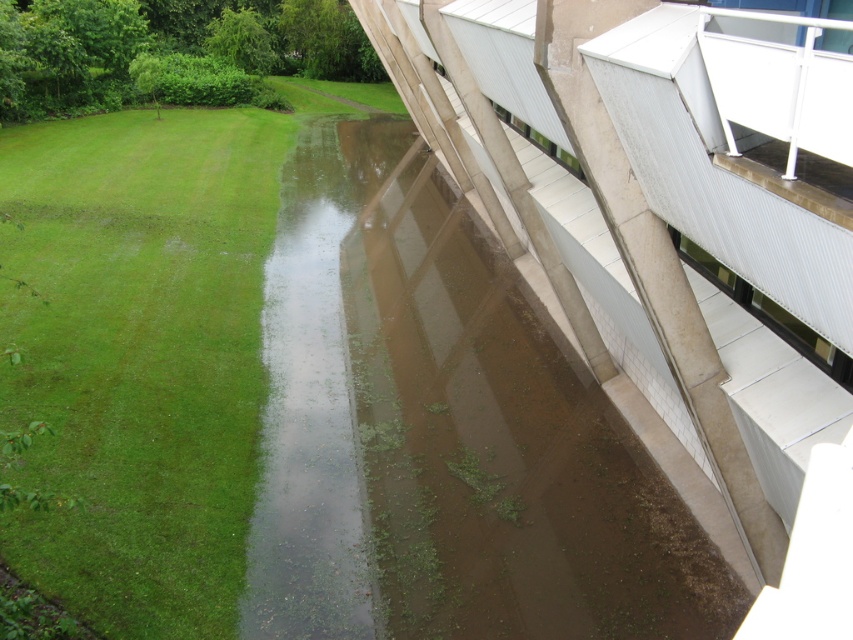
Question: Can you confirm if brown concrete at center is smaller than green grass at lower left?

Choices:
 (A) no
 (B) yes

Answer: (B)

Question: Which object appears closest to the camera in this image?

Choices:
 (A) brown concrete at center
 (B) green grass at lower left

Answer: (B)

Question: Is brown concrete at center positioned at the back of green grass at lower left?

Choices:
 (A) no
 (B) yes

Answer: (B)

Question: Which point appears closest to the camera in this image?

Choices:
 (A) (33, 365)
 (B) (405, 525)

Answer: (B)

Question: Which of the following is the farthest from the observer?

Choices:
 (A) (515, 410)
 (B) (213, 141)

Answer: (B)

Question: From the image, what is the correct spatial relationship of brown concrete at center in relation to green grass at lower left?

Choices:
 (A) below
 (B) above

Answer: (A)